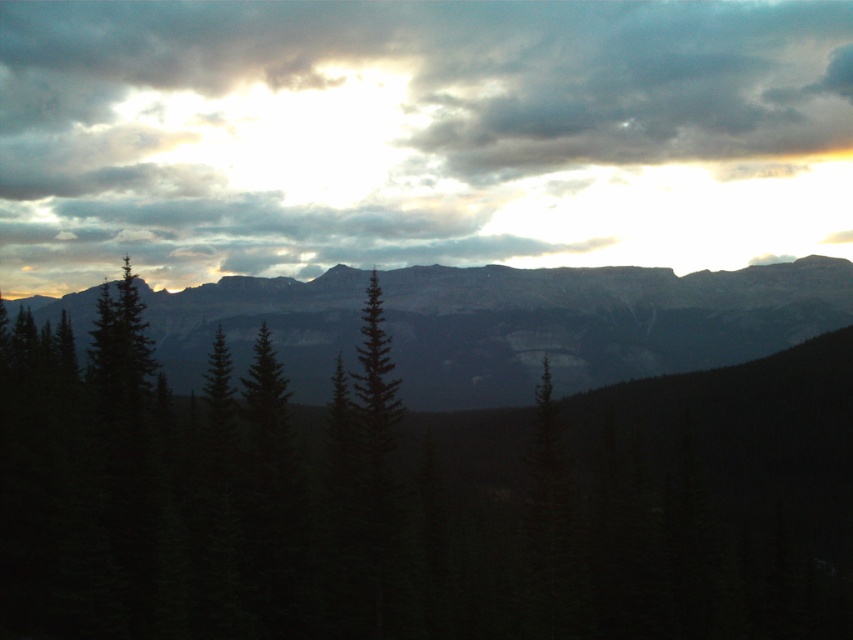
You are an outdoor photographer planning to capture the sunrise over the dark gray rocky mountain range at center. You notice the dark green pine at center in the foreground. Will the pine block the view of the mountain range during the shot?

The dark green pine at center is located above the dark gray rocky mountain range at center, so it will block the view of the mountain range during the shot.

Based on the photo, you are standing in the mountain landscape and want to take a photo of the dark green pine at center. Where should you position yourself to capture it in the frame?

You should position yourself at point (431, 472) to capture the dark green pine at center in the frame.